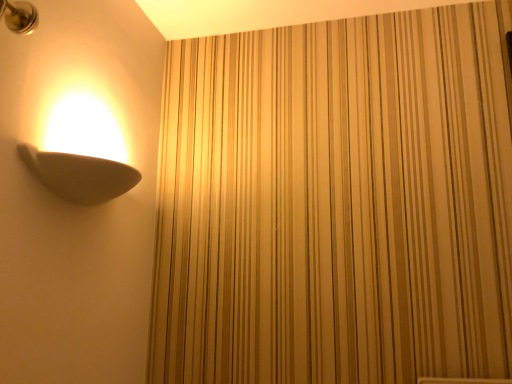
Locate an element on the screen. This screenshot has width=512, height=384. matte white lamp at left is located at coordinates (82, 154).

Measure the distance between point (62, 167) and camera.

The depth of point (62, 167) is 36.18 inches.

What do you see at coordinates (82, 154) in the screenshot? I see `matte white lamp at left` at bounding box center [82, 154].

You are a GUI agent. You are given a task and a screenshot of the screen. Output one action in this format:
    pyautogui.click(x=<x>, y=<y>)
    Task: Click on the matte white lamp at left
    
    Given the screenshot: What is the action you would take?
    pyautogui.click(x=82, y=154)